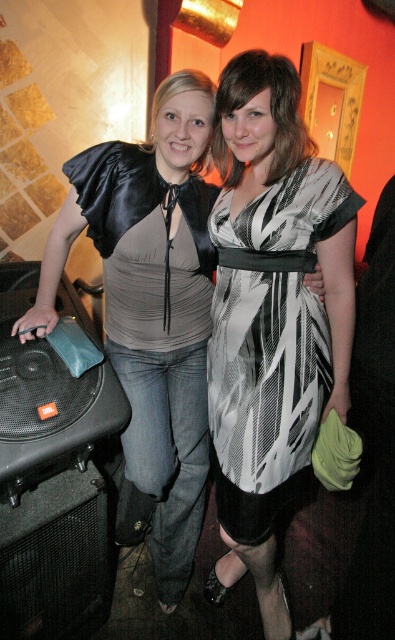
Who is more distant from viewer, (3, 586) or (280, 70)?

Positioned behind is point (3, 586).

In order to click on black mesh speaker at lower left in this screenshot , I will do `click(54, 557)`.

The width and height of the screenshot is (395, 640). What are the coordinates of `black mesh speaker at lower left` in the screenshot? It's located at pyautogui.click(x=54, y=557).

Who is lower down, black and white printed dress at center or black and white striped dress at center?

black and white printed dress at center

Does black and white printed dress at center come in front of black and white striped dress at center?

No.

Is point (237, 228) positioned after point (291, 99)?

Yes, point (237, 228) is farther from viewer.

The width and height of the screenshot is (395, 640). Find the location of `black and white printed dress at center`. black and white printed dress at center is located at coordinates (272, 316).

Who is lower down, black and white printed dress at center or black mesh speaker at lower left?

black mesh speaker at lower left is below.

Can you confirm if black and white printed dress at center is positioned below black mesh speaker at lower left?

No, black and white printed dress at center is not below black mesh speaker at lower left.

Does point (244, 481) lie in front of point (33, 566)?

No, (244, 481) is behind (33, 566).

The width and height of the screenshot is (395, 640). Find the location of `black and white printed dress at center`. black and white printed dress at center is located at coordinates (272, 316).